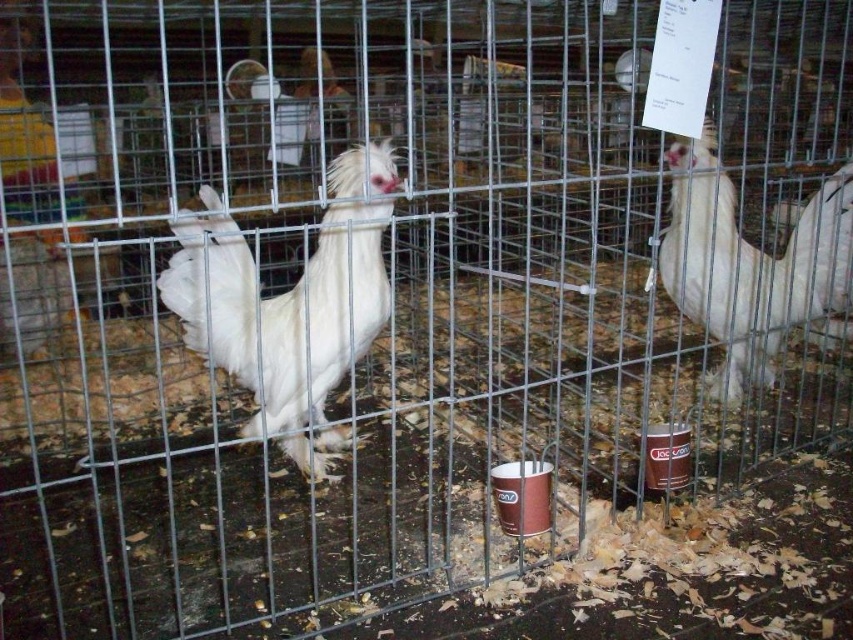
Is white feathered rooster at center below white fluffy chicken at right?

Indeed, white feathered rooster at center is positioned under white fluffy chicken at right.

Which of these two, white feathered rooster at center or white fluffy chicken at right, stands shorter?

Standing shorter between the two is white fluffy chicken at right.

Who is more forward, (184, 324) or (825, 268)?

Point (184, 324)

This screenshot has height=640, width=853. I want to click on white feathered rooster at center, so click(x=289, y=305).